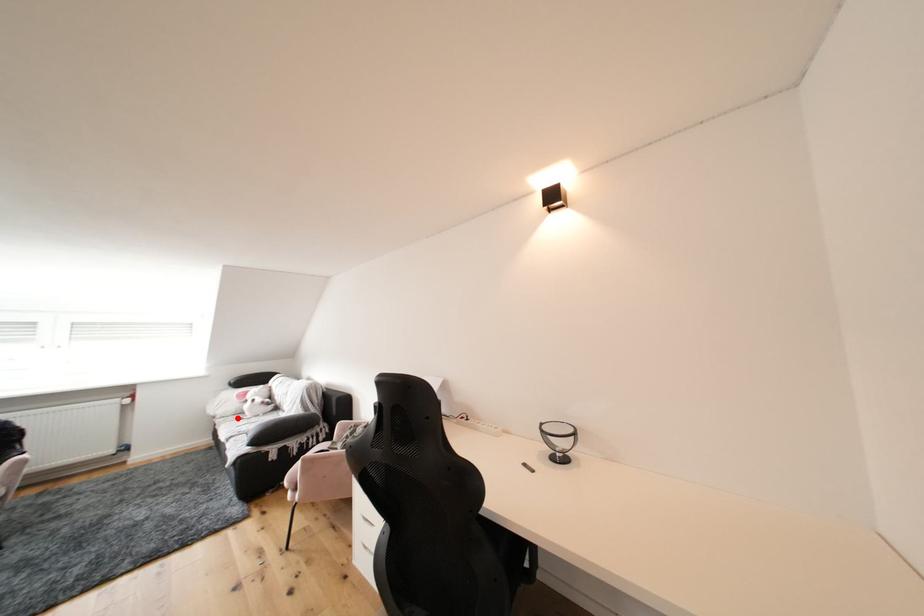
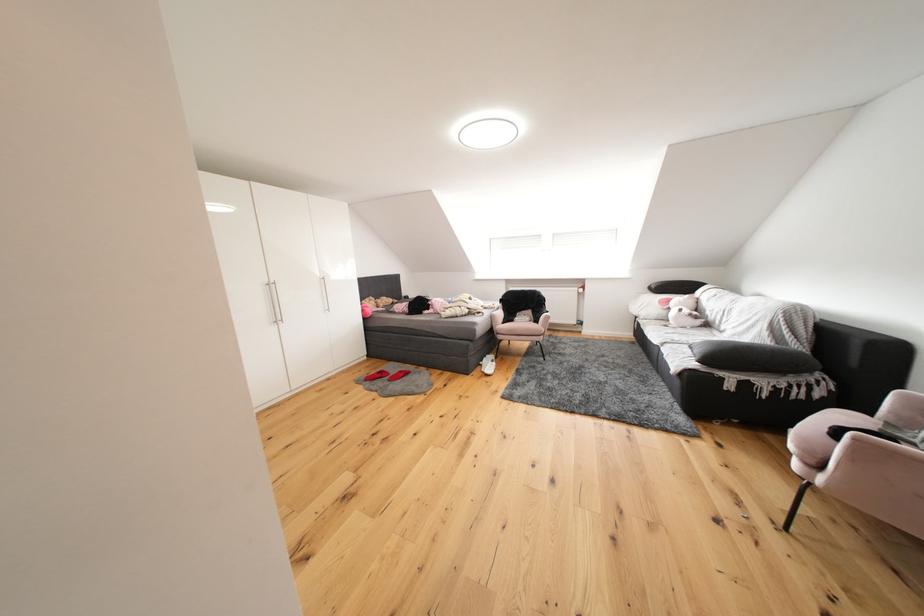
In the second image, find the point that corresponds to the highlighted location in the first image.

(660, 321)